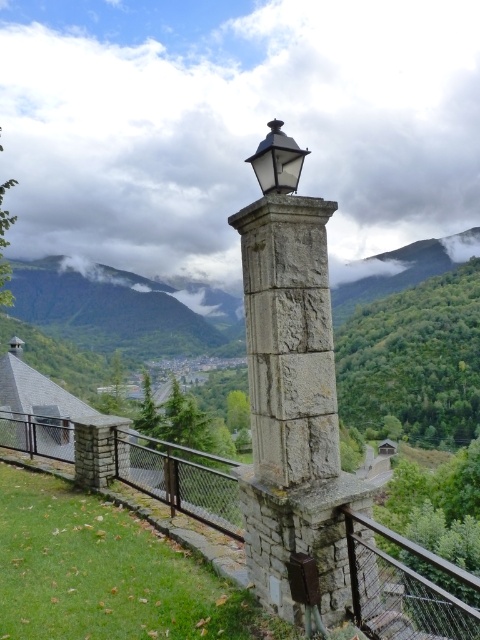
You are standing in front of the stone lamppost and want to place a small potted plant between the rusty metal fence at center and the matte black lantern at upper center. Based on their positions, where should you place the potted plant?

The rusty metal fence at center is to the left of matte black lantern at upper center, so you should place the potted plant between them to the right of the rusty metal fence at center and to the left of the matte black lantern at upper center.

You are a maintenance worker needing to reach the matte black lantern at upper center from the rusty metal fence at center. Given that your ladder is 8 meters long, will it be sufficient to reach the lantern?

The distance between the rusty metal fence at center and the matte black lantern at upper center is 9.48 meters. Since the ladder is only 8 meters long, it will not be long enough to bridge the gap between the rusty metal fence at center and the matte black lantern at upper center.

You are a painter who wants to capture the scene accurately. You need to decide which object, the rusty metal fence at center or the matte black lantern at upper center, would require more attention to detail due to its size. Which one should you focus on?

The rusty metal fence at center has a larger size compared to the matte black lantern at upper center, so you should focus more on the rusty metal fence at center to capture its details accurately.